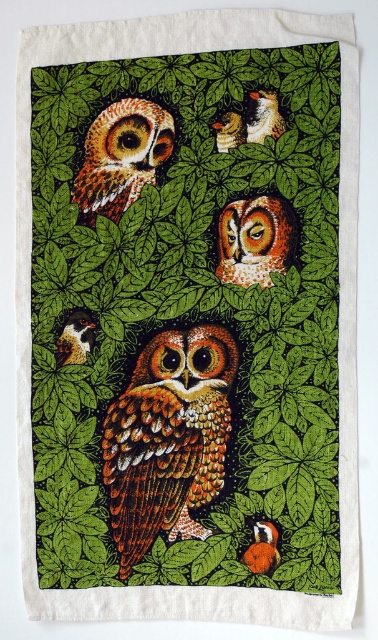
Question: Considering the real-world distances, which object is closest to the speckled brown owl at center?

Choices:
 (A) speckled white owl at upper center
 (B) matte orange owl at upper center

Answer: (B)

Question: Which object is farther from the camera taking this photo?

Choices:
 (A) brown speckled owl at upper left
 (B) brown speckled owl at upper center
 (C) speckled white owl at upper center

Answer: (C)

Question: From the image, what is the correct spatial relationship of brown speckled owl at upper left in relation to speckled brown owl at center?

Choices:
 (A) right
 (B) left

Answer: (B)

Question: Does shiny brown owl at center have a lesser width compared to speckled brown owl at center?

Choices:
 (A) yes
 (B) no

Answer: (B)

Question: Which point is farther to the camera?

Choices:
 (A) shiny brown owl at center
 (B) speckled white owl at upper center
 (C) speckled brown owl at center

Answer: (B)

Question: Can you confirm if speckled white owl at upper center is thinner than orange felt bird at center?

Choices:
 (A) yes
 (B) no

Answer: (B)